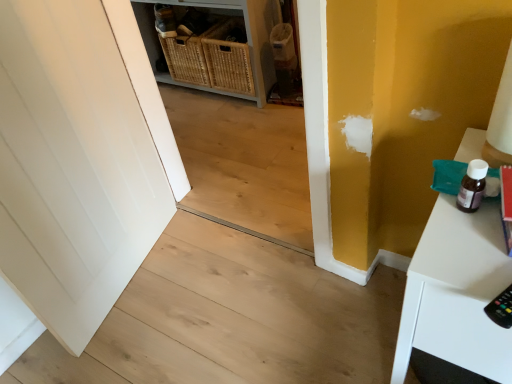
In order to click on vacant area on top of white glossy table at right (from a real-world perspective) in this screenshot , I will do `click(471, 223)`.